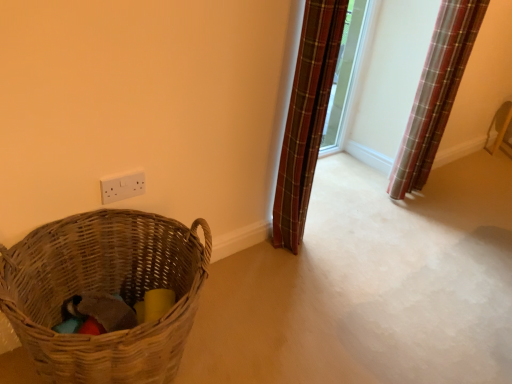
This screenshot has height=384, width=512. Describe the element at coordinates (436, 92) in the screenshot. I see `plaid fabric curtain at right, placed as the first curtain when sorted from right to left` at that location.

This screenshot has height=384, width=512. In order to click on plaid fabric curtain at upper right, which is the second curtain in right-to-left order in this screenshot , I will do `click(306, 118)`.

Locate an element on the screen. The image size is (512, 384). white plastic electric outlet at upper center is located at coordinates (122, 186).

The height and width of the screenshot is (384, 512). I want to click on plaid fabric curtain at right, the 2th curtain viewed from the left, so click(436, 92).

Does woven brown basket at lower left have a greater height compared to plaid fabric curtain at upper right, which is the second curtain in right-to-left order?

No.

From the image's perspective, is woven brown basket at lower left located above or below plaid fabric curtain at upper right, which is the second curtain in right-to-left order?

From the image's perspective, woven brown basket at lower left appears below plaid fabric curtain at upper right, which is the second curtain in right-to-left order.

Based on their positions, is woven brown basket at lower left located to the left or right of plaid fabric curtain at upper right, which is the second curtain in right-to-left order?

woven brown basket at lower left is positioned on plaid fabric curtain at upper right, which is the second curtain in right-to-left order,'s left side.

Find the location of a particular element. The height and width of the screenshot is (384, 512). picnic basket below the plaid fabric curtain at upper right, marked as the first curtain in a left-to-right arrangement (from a real-world perspective) is located at coordinates (105, 291).

Does point (110, 184) appear closer or farther from the camera than point (458, 44)?

Point (110, 184) is closer to the camera than point (458, 44).

Which of these two, white plastic electric outlet at upper center or plaid fabric curtain at right, the 2th curtain viewed from the left, is bigger?

With larger size is plaid fabric curtain at right, the 2th curtain viewed from the left.

Which of these two, white plastic electric outlet at upper center or plaid fabric curtain at right, placed as the first curtain when sorted from right to left, is thinner?

white plastic electric outlet at upper center.

How different are the orientations of white plastic electric outlet at upper center and plaid fabric curtain at right, the 2th curtain viewed from the left, in degrees?

1.43 degrees.

Which of these two, woven brown basket at lower left or white plastic electric outlet at upper center, is bigger?

woven brown basket at lower left.

Can you confirm if woven brown basket at lower left is positioned to the right of white plastic electric outlet at upper center?

Indeed, woven brown basket at lower left is positioned on the right side of white plastic electric outlet at upper center.

Which is correct: woven brown basket at lower left is inside white plastic electric outlet at upper center, or outside of it?

woven brown basket at lower left is not inside white plastic electric outlet at upper center, it's outside.

Is there a large distance between woven brown basket at lower left and white plastic electric outlet at upper center?

No, woven brown basket at lower left is in close proximity to white plastic electric outlet at upper center.

Considering the sizes of objects plaid fabric curtain at upper right, marked as the first curtain in a left-to-right arrangement, and woven brown basket at lower left in the image provided, who is taller, plaid fabric curtain at upper right, marked as the first curtain in a left-to-right arrangement, or woven brown basket at lower left?

With more height is plaid fabric curtain at upper right, marked as the first curtain in a left-to-right arrangement.

Is the depth of plaid fabric curtain at upper right, marked as the first curtain in a left-to-right arrangement, greater than that of woven brown basket at lower left?

Yes, the depth of plaid fabric curtain at upper right, marked as the first curtain in a left-to-right arrangement, is greater than that of woven brown basket at lower left.

From a real-world perspective, which object stands above the other?

In real-world perspective, plaid fabric curtain at upper right, marked as the first curtain in a left-to-right arrangement, is above.

Is there a large distance between plaid fabric curtain at upper right, marked as the first curtain in a left-to-right arrangement, and woven brown basket at lower left?

Actually, plaid fabric curtain at upper right, marked as the first curtain in a left-to-right arrangement, and woven brown basket at lower left are a little close together.

Who is more distant, plaid fabric curtain at right, the 2th curtain viewed from the left, or woven brown basket at lower left?

plaid fabric curtain at right, the 2th curtain viewed from the left, is further from the camera.

From the image's perspective, is plaid fabric curtain at right, placed as the first curtain when sorted from right to left, located above woven brown basket at lower left?

Yes, from the image's perspective, plaid fabric curtain at right, placed as the first curtain when sorted from right to left, is over woven brown basket at lower left.

Would you say plaid fabric curtain at right, placed as the first curtain when sorted from right to left, is to the left or to the right of woven brown basket at lower left in the picture?

Clearly, plaid fabric curtain at right, placed as the first curtain when sorted from right to left, is on the right of woven brown basket at lower left in the image.

In the scene shown: Between plaid fabric curtain at right, the 2th curtain viewed from the left, and woven brown basket at lower left, which one has more height?

With more height is plaid fabric curtain at right, the 2th curtain viewed from the left.

Based on the photo, would you consider plaid fabric curtain at upper right, marked as the first curtain in a left-to-right arrangement, to be distant from plaid fabric curtain at right, the 2th curtain viewed from the left?

No, plaid fabric curtain at upper right, marked as the first curtain in a left-to-right arrangement, is in close proximity to plaid fabric curtain at right, the 2th curtain viewed from the left.

How distant is plaid fabric curtain at upper right, which is the second curtain in right-to-left order, from plaid fabric curtain at right, the 2th curtain viewed from the left?

plaid fabric curtain at upper right, which is the second curtain in right-to-left order, is 31.37 inches from plaid fabric curtain at right, the 2th curtain viewed from the left.

Who is more distant, plaid fabric curtain at upper right, marked as the first curtain in a left-to-right arrangement, or plaid fabric curtain at right, the 2th curtain viewed from the left?

plaid fabric curtain at right, the 2th curtain viewed from the left.

Considering the relative sizes of plaid fabric curtain at upper right, which is the second curtain in right-to-left order, and plaid fabric curtain at right, the 2th curtain viewed from the left, in the image provided, is plaid fabric curtain at upper right, which is the second curtain in right-to-left order, smaller than plaid fabric curtain at right, the 2th curtain viewed from the left,?

Correct, plaid fabric curtain at upper right, which is the second curtain in right-to-left order, occupies less space than plaid fabric curtain at right, the 2th curtain viewed from the left.

Does woven brown basket at lower left come behind plaid fabric curtain at right, placed as the first curtain when sorted from right to left?

That is False.

Which is behind, point (126, 217) or point (443, 81)?

Positioned behind is point (443, 81).

Which of these two, woven brown basket at lower left or plaid fabric curtain at right, the 2th curtain viewed from the left, is smaller?

With smaller size is plaid fabric curtain at right, the 2th curtain viewed from the left.

Is woven brown basket at lower left wider or thinner than plaid fabric curtain at right, placed as the first curtain when sorted from right to left?

In the image, woven brown basket at lower left appears to be wider than plaid fabric curtain at right, placed as the first curtain when sorted from right to left.

I want to click on curtain that is the 1st object to the right of the woven brown basket at lower left, starting at the anchor, so click(x=306, y=118).

Locate an element on the screen. curtain behind the white plastic electric outlet at upper center is located at coordinates (436, 92).

From the image, which object appears to be nearer to plaid fabric curtain at upper right, which is the second curtain in right-to-left order, plaid fabric curtain at right, the 2th curtain viewed from the left, or woven brown basket at lower left?

Among the two, woven brown basket at lower left is located nearer to plaid fabric curtain at upper right, which is the second curtain in right-to-left order.

In the scene shown: From the image, which object appears to be farther from white plastic electric outlet at upper center, woven brown basket at lower left or plaid fabric curtain at right, the 2th curtain viewed from the left?

plaid fabric curtain at right, the 2th curtain viewed from the left.

From the image, which object appears to be farther from plaid fabric curtain at right, the 2th curtain viewed from the left, plaid fabric curtain at upper right, which is the second curtain in right-to-left order, or white plastic electric outlet at upper center?

white plastic electric outlet at upper center.

Estimate the real-world distances between objects in this image. Which object is closer to plaid fabric curtain at right, the 2th curtain viewed from the left, woven brown basket at lower left or white plastic electric outlet at upper center?

white plastic electric outlet at upper center is positioned closer to the anchor plaid fabric curtain at right, the 2th curtain viewed from the left.

Considering their positions, is plaid fabric curtain at right, the 2th curtain viewed from the left, positioned further to white plastic electric outlet at upper center than woven brown basket at lower left?

plaid fabric curtain at right, the 2th curtain viewed from the left, is further to white plastic electric outlet at upper center.

Based on their spatial positions, is plaid fabric curtain at right, the 2th curtain viewed from the left, or plaid fabric curtain at upper right, which is the second curtain in right-to-left order, closer to woven brown basket at lower left?

The object closer to woven brown basket at lower left is plaid fabric curtain at upper right, which is the second curtain in right-to-left order.

Based on the photo, considering their positions, is white plastic electric outlet at upper center positioned further to plaid fabric curtain at upper right, which is the second curtain in right-to-left order, than woven brown basket at lower left?

Among the two, woven brown basket at lower left is located further to plaid fabric curtain at upper right, which is the second curtain in right-to-left order.

Considering their positions, is white plastic electric outlet at upper center positioned further to plaid fabric curtain at right, the 2th curtain viewed from the left, than plaid fabric curtain at upper right, marked as the first curtain in a left-to-right arrangement?

Based on the image, white plastic electric outlet at upper center appears to be further to plaid fabric curtain at right, the 2th curtain viewed from the left.

Identify the location of picnic basket between white plastic electric outlet at upper center and plaid fabric curtain at upper right, marked as the first curtain in a left-to-right arrangement, in the horizontal direction. The width and height of the screenshot is (512, 384). (105, 291).

This screenshot has width=512, height=384. I want to click on curtain situated between woven brown basket at lower left and plaid fabric curtain at right, placed as the first curtain when sorted from right to left, from left to right, so click(306, 118).

Identify the location of curtain located between white plastic electric outlet at upper center and plaid fabric curtain at right, the 2th curtain viewed from the left, in the left-right direction. This screenshot has width=512, height=384. (306, 118).

Where is `picnic basket between white plastic electric outlet at upper center and plaid fabric curtain at right, the 2th curtain viewed from the left`? Image resolution: width=512 pixels, height=384 pixels. picnic basket between white plastic electric outlet at upper center and plaid fabric curtain at right, the 2th curtain viewed from the left is located at coordinates (105, 291).